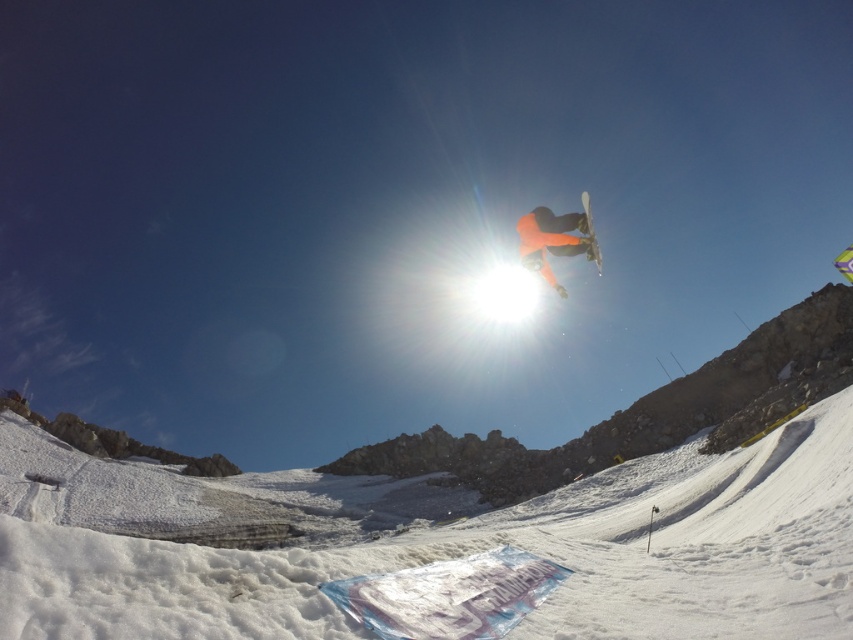
Question: Which object is the closest to the orange matte snowboarder at center?

Choices:
 (A) white matte snowboard at center
 (B) white powdery snow at center

Answer: (A)

Question: Does orange matte snowboarder at center lie behind white matte snowboard at center?

Choices:
 (A) no
 (B) yes

Answer: (A)

Question: Which point appears closest to the camera in this image?

Choices:
 (A) (538, 209)
 (B) (590, 257)
 (C) (788, 513)

Answer: (C)

Question: Based on their relative distances, which object is farther from the white powdery snow at center?

Choices:
 (A) white matte snowboard at center
 (B) orange matte snowboarder at center

Answer: (B)

Question: From the image, what is the correct spatial relationship of orange matte snowboarder at center in relation to white matte snowboard at center?

Choices:
 (A) left
 (B) right

Answer: (A)

Question: Does white powdery snow at center appear on the left side of orange matte snowboarder at center?

Choices:
 (A) no
 (B) yes

Answer: (B)